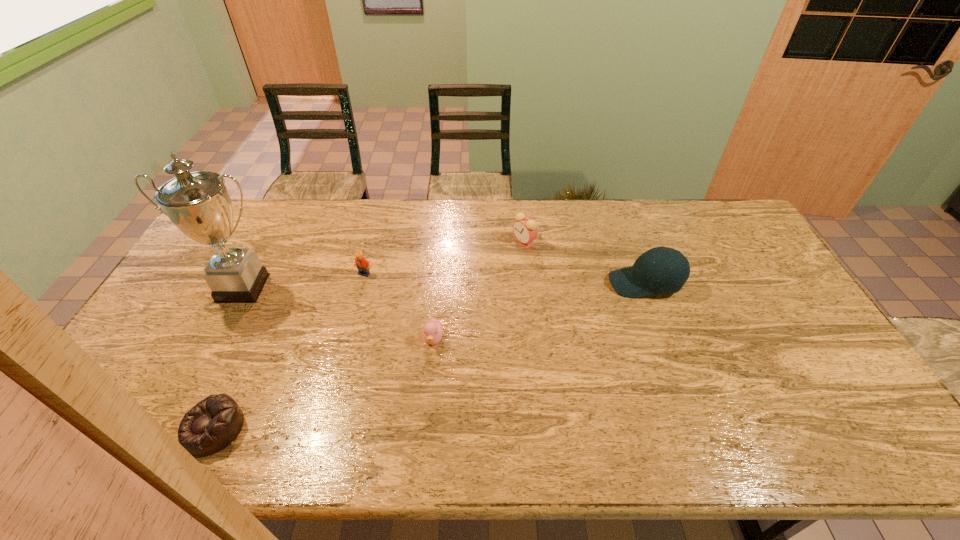
Identify the location of vacant area that lies between the tallest object and the fourth object from left to right. Image resolution: width=960 pixels, height=540 pixels. (338, 313).

In order to click on vacant space that's between the baseball cap and the farthest object in this screenshot , I will do `click(585, 262)`.

Find the location of a particular element. The height and width of the screenshot is (540, 960). free point between the fourth object from right to left and the third object from right to left is located at coordinates (399, 306).

At what (x,y) coordinates should I click in order to perform the action: click on free spot between the tallest object and the alarm clock. Please return your answer as a coordinate pair (x, y). The image size is (960, 540). Looking at the image, I should click on (383, 265).

Where is `free point between the second nearest object and the farthest object`? free point between the second nearest object and the farthest object is located at coordinates (479, 291).

The image size is (960, 540). Find the location of `free space between the baseball cap and the tallest object`. free space between the baseball cap and the tallest object is located at coordinates (444, 286).

Where is `the second closest object to the trophy cup`? This screenshot has width=960, height=540. the second closest object to the trophy cup is located at coordinates (214, 423).

In order to click on the closest object relative to the beanbag in this screenshot , I will do `click(197, 203)`.

Image resolution: width=960 pixels, height=540 pixels. Find the location of `free location that satisfies the following two spatial constraints: 1. on the front-facing side of the rightmost object; 2. on the front-facing side of the duckling`. free location that satisfies the following two spatial constraints: 1. on the front-facing side of the rightmost object; 2. on the front-facing side of the duckling is located at coordinates (665, 339).

What are the coordinates of `free space that satisfies the following two spatial constraints: 1. on the front-facing side of the baseball cap; 2. on the front-facing side of the second nearest object` in the screenshot? It's located at (665, 339).